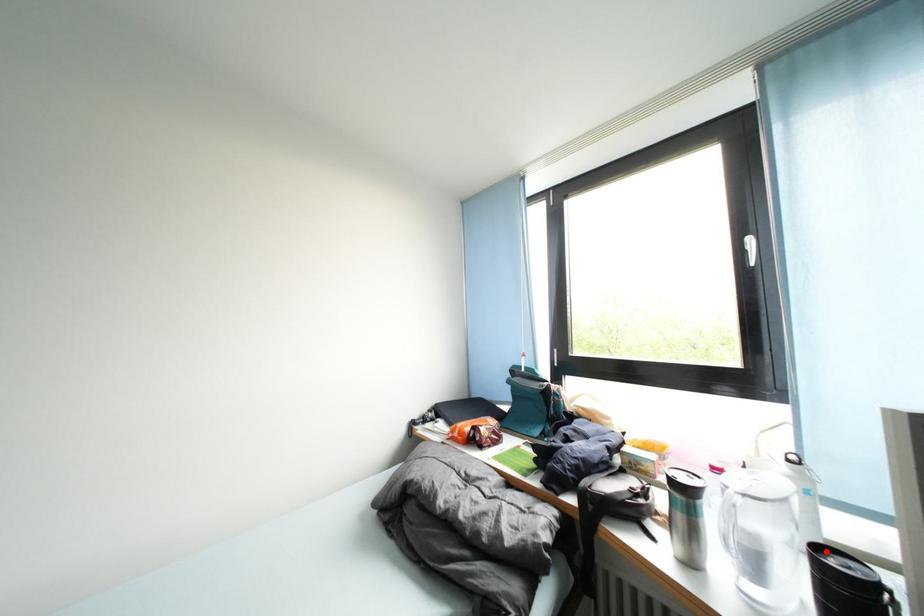
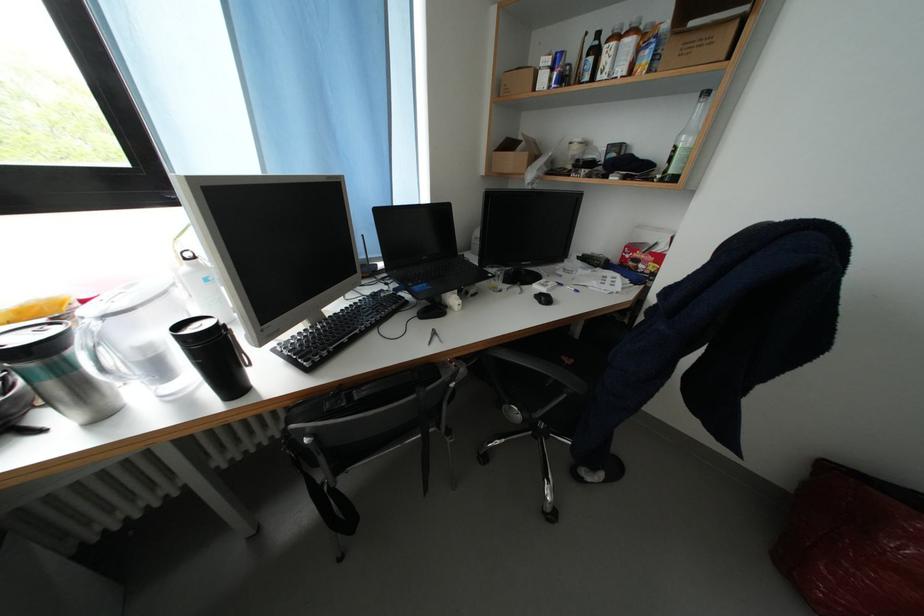
In the second image, find the point that corresponds to the highlighted location in the first image.

(188, 330)